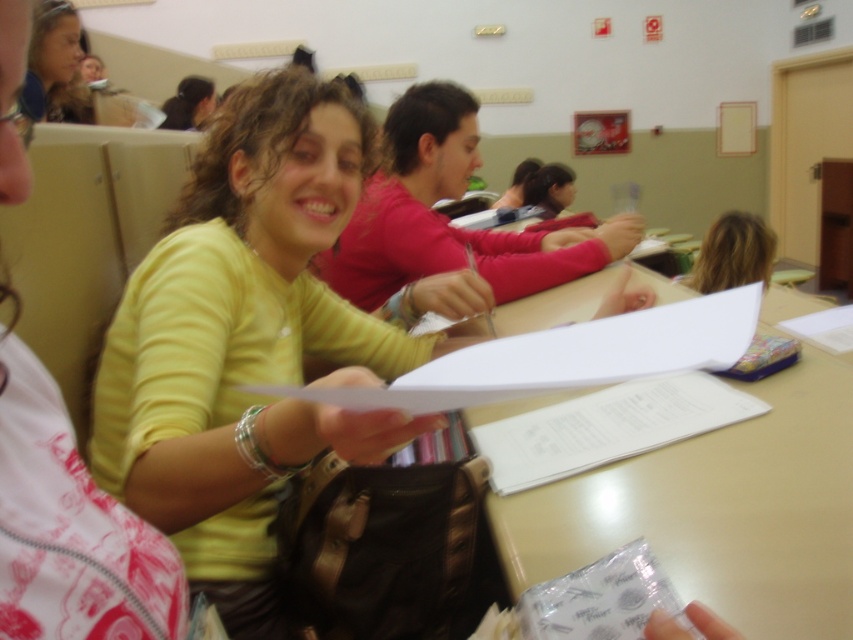
You are standing in the classroom and want to move from the point at coordinates point [254,106] to the point at coordinates point [91,113]. Can you walk directly between them without any obstacles?

Point [254,106] is in front of point [91,113], so there is no obstacle blocking the path between them. You can walk directly between them.

Consider the image. What are the coordinates of the yellow matte sweater at center?

The yellow matte sweater at center is located at coordinates point (247, 342).